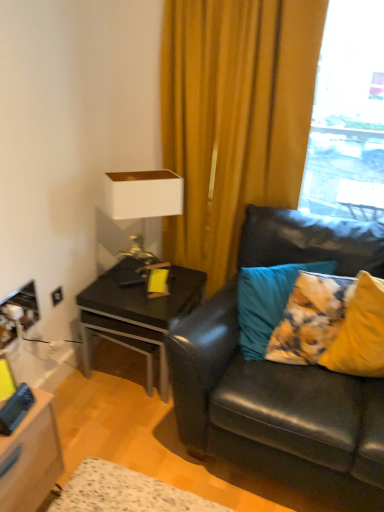
Question: From the image's perspective, is black leather couch at right on top of transparent glass window at upper right?

Choices:
 (A) yes
 (B) no

Answer: (B)

Question: Can you confirm if black leather couch at right is wider than transparent glass window at upper right?

Choices:
 (A) no
 (B) yes

Answer: (B)

Question: Is black leather couch at right not near transparent glass window at upper right?

Choices:
 (A) yes
 (B) no

Answer: (A)

Question: Does black leather couch at right touch transparent glass window at upper right?

Choices:
 (A) yes
 (B) no

Answer: (B)

Question: Can you confirm if black leather couch at right is bigger than transparent glass window at upper right?

Choices:
 (A) no
 (B) yes

Answer: (B)

Question: Would you say black leather couch at right is outside transparent glass window at upper right?

Choices:
 (A) no
 (B) yes

Answer: (B)

Question: From a real-world perspective, is yellow fabric pillow at right, which is the 1th pillow from right to left, under black leather couch at right?

Choices:
 (A) no
 (B) yes

Answer: (A)

Question: Is black leather couch at right inside yellow fabric pillow at right, which is the 1th pillow from right to left?

Choices:
 (A) yes
 (B) no

Answer: (B)

Question: Does yellow fabric pillow at right, which is the 1th pillow from right to left, have a greater height compared to black leather couch at right?

Choices:
 (A) no
 (B) yes

Answer: (A)

Question: Considering the relative sizes of yellow fabric pillow at right, which is the 2th pillow from left to right, and black leather couch at right in the image provided, is yellow fabric pillow at right, which is the 2th pillow from left to right, shorter than black leather couch at right?

Choices:
 (A) yes
 (B) no

Answer: (A)

Question: Does yellow fabric pillow at right, which is the 1th pillow from right to left, have a smaller size compared to black leather couch at right?

Choices:
 (A) yes
 (B) no

Answer: (A)

Question: Is yellow fabric pillow at right, which is the 1th pillow from right to left, positioned far away from black leather couch at right?

Choices:
 (A) no
 (B) yes

Answer: (A)

Question: Are teal fabric pillow at right, marked as the second pillow in a right-to-left arrangement, and black leather couch at right far apart?

Choices:
 (A) yes
 (B) no

Answer: (B)